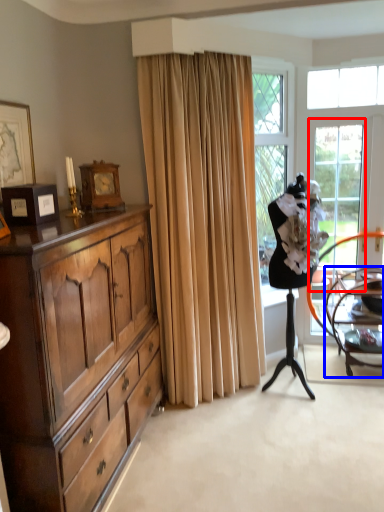
Question: Which of the following is the farthest to the observer, screen door (highlighted by a red box) or chair (highlighted by a blue box)?

Choices:
 (A) screen door
 (B) chair

Answer: (A)